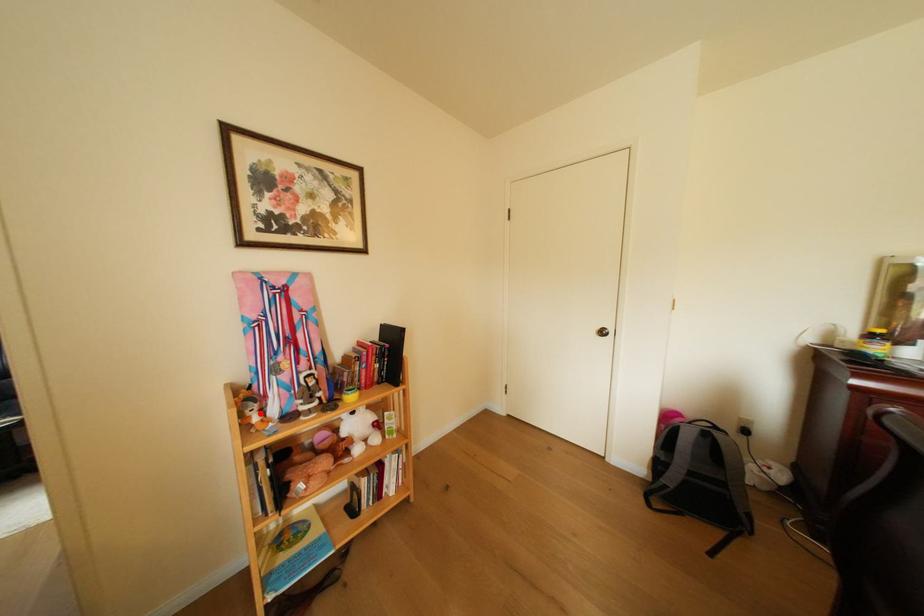
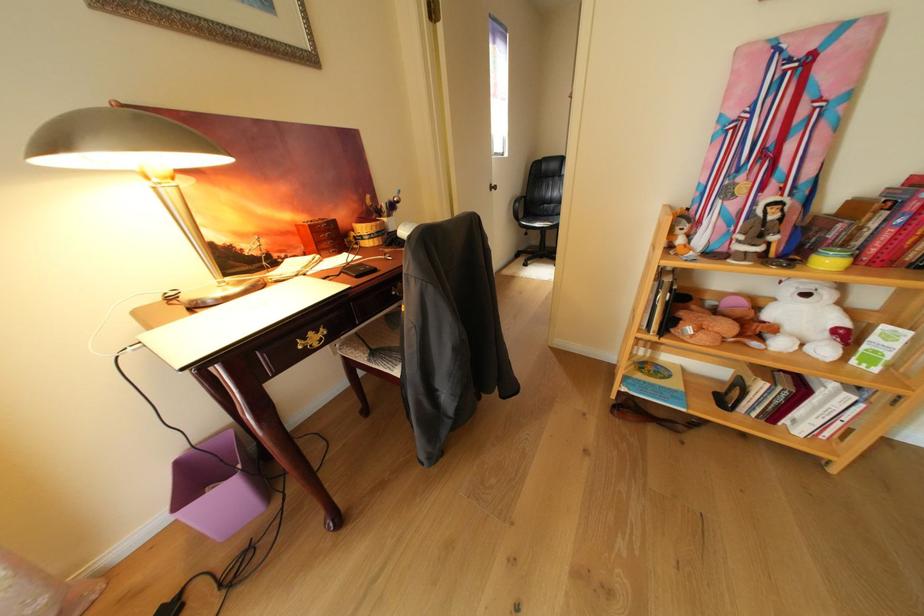
Where in the second image is the point corresponding to the highlighted location from the first image?

(689, 230)